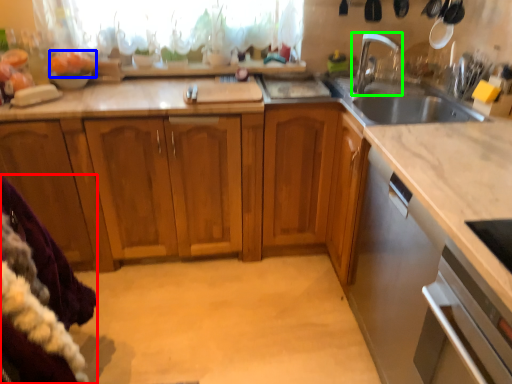
Question: Estimate the real-world distances between objects in this image. Which object is closer to blanket (highlighted by a red box), food (highlighted by a blue box) or tap (highlighted by a green box)?

Choices:
 (A) food
 (B) tap

Answer: (A)